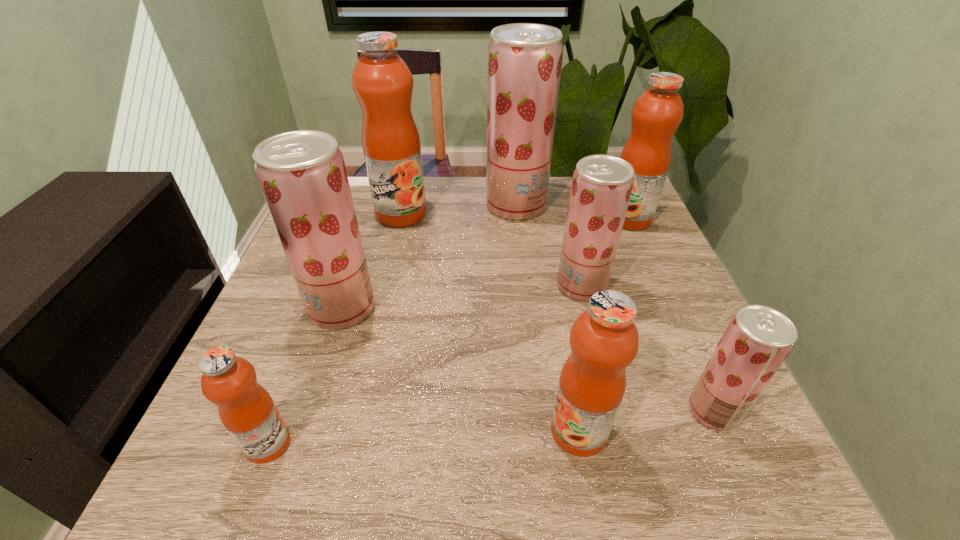
This screenshot has height=540, width=960. In order to click on vacant area situated on the front label of the smallest orange fruit juice in this screenshot , I will do coord(423,443).

What are the coordinates of `object that is at the near left corner` in the screenshot? It's located at (246, 409).

Where is `object present at the far right corner`? object present at the far right corner is located at coordinates (658, 111).

In order to click on vacant space at the far edge of the desktop in this screenshot , I will do `click(472, 188)`.

Image resolution: width=960 pixels, height=540 pixels. In order to click on free spot at the near edge of the desktop in this screenshot , I will do `click(516, 457)`.

In the image, there is a desktop. Identify the location of vacant space at the left edge. (271, 329).

Image resolution: width=960 pixels, height=540 pixels. What are the coordinates of `vacant area at the right edge` in the screenshot? It's located at (655, 266).

At what (x,y) coordinates should I click in order to perform the action: click on free point at the far left corner. Please return your answer as a coordinate pair (x, y). Looking at the image, I should click on (352, 193).

I want to click on vacant space at the near right corner, so click(680, 473).

Where is `vacant point located between the second orange fruit juice from right to left and the biggest orange fruit juice`? vacant point located between the second orange fruit juice from right to left and the biggest orange fruit juice is located at coordinates (490, 322).